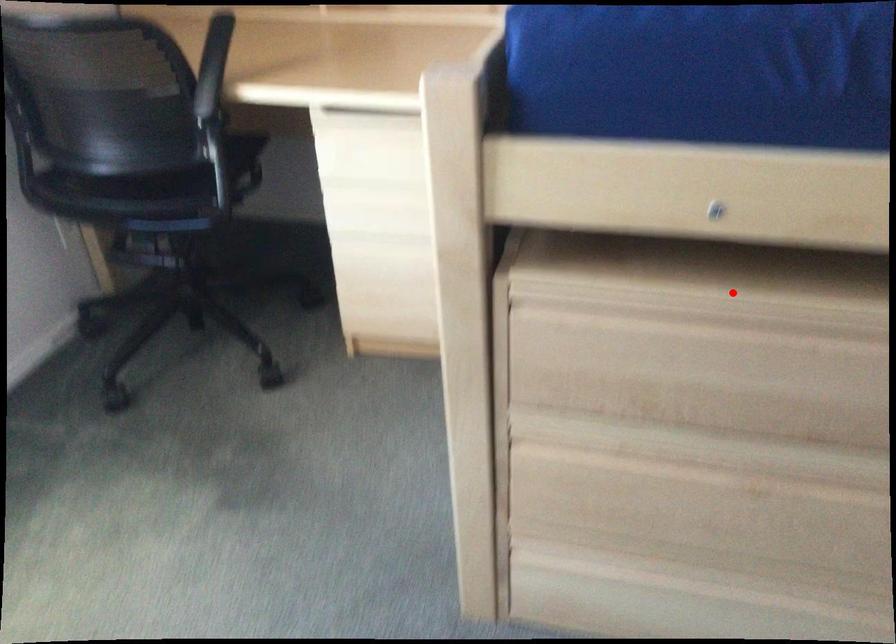
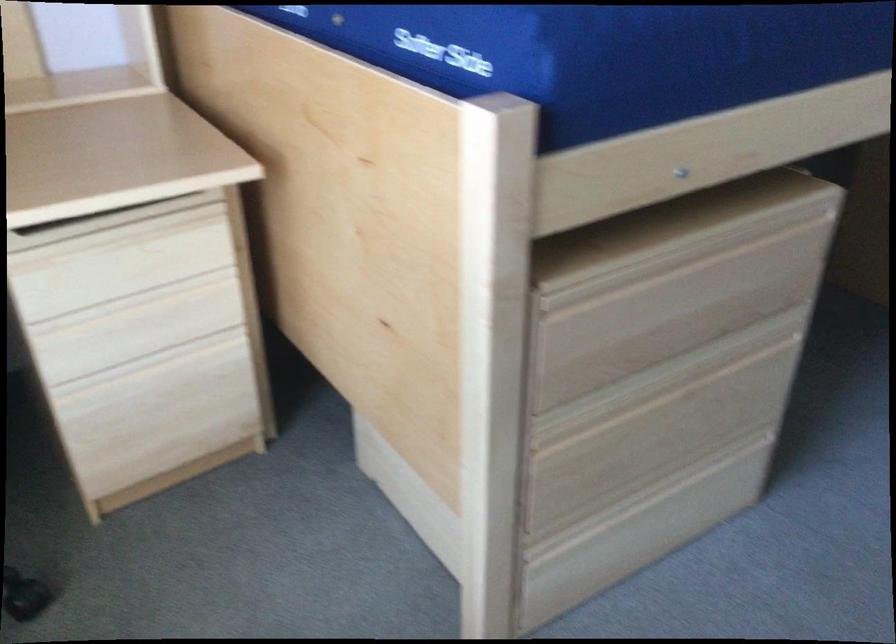
Find the pixel in the second image that matches the highlighted location in the first image.

(668, 240)